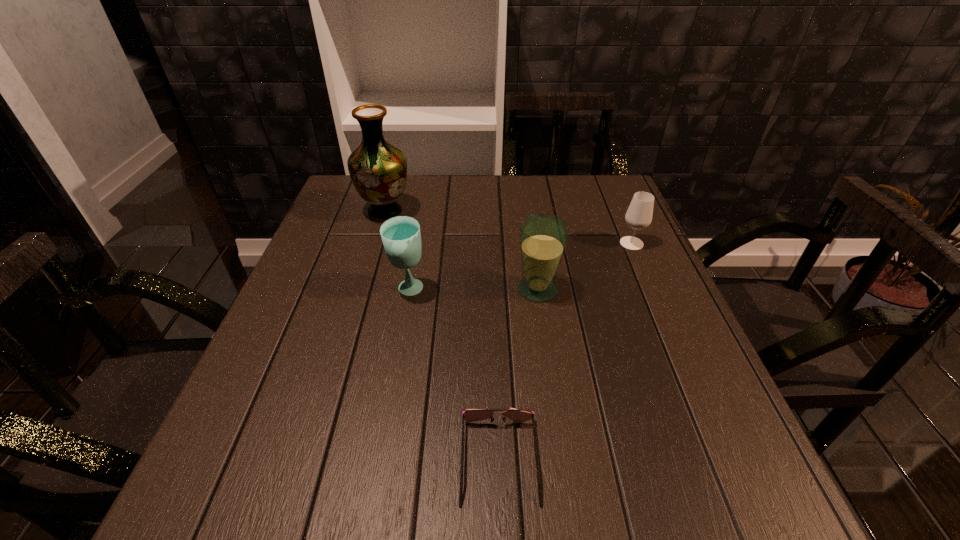
You are a GUI agent. You are given a task and a screenshot of the screen. Output one action in this format:
    pyautogui.click(x=<x>, y=<y>)
    Task: Click on the vacant position located 0.280m on the left of the second glass from right to left
    The width and height of the screenshot is (960, 540).
    Given the screenshot: What is the action you would take?
    pyautogui.click(x=389, y=289)

Image resolution: width=960 pixels, height=540 pixels. I want to click on free location located on the back of the second farthest object, so click(608, 188).

Where is `object situated at the far edge`? Image resolution: width=960 pixels, height=540 pixels. object situated at the far edge is located at coordinates (378, 170).

Find the location of `object at the near edge`. object at the near edge is located at coordinates (471, 415).

Where is `object located at the left edge`? The height and width of the screenshot is (540, 960). object located at the left edge is located at coordinates (378, 170).

The image size is (960, 540). In order to click on object at the right edge in this screenshot , I will do `click(639, 214)`.

The width and height of the screenshot is (960, 540). In order to click on object at the far left corner in this screenshot , I will do `click(378, 170)`.

The width and height of the screenshot is (960, 540). Identify the location of vacant space at the far edge of the desktop. (499, 179).

Find the location of `free location at the near edge of the desktop`. free location at the near edge of the desktop is located at coordinates (614, 518).

In the image, there is a desktop. Where is `vacant space at the left edge`? vacant space at the left edge is located at coordinates click(344, 290).